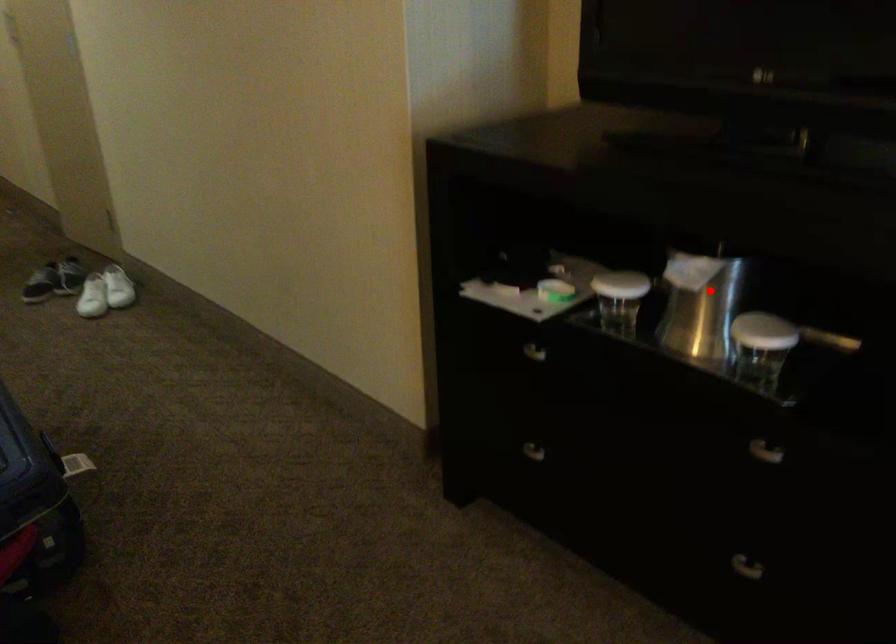
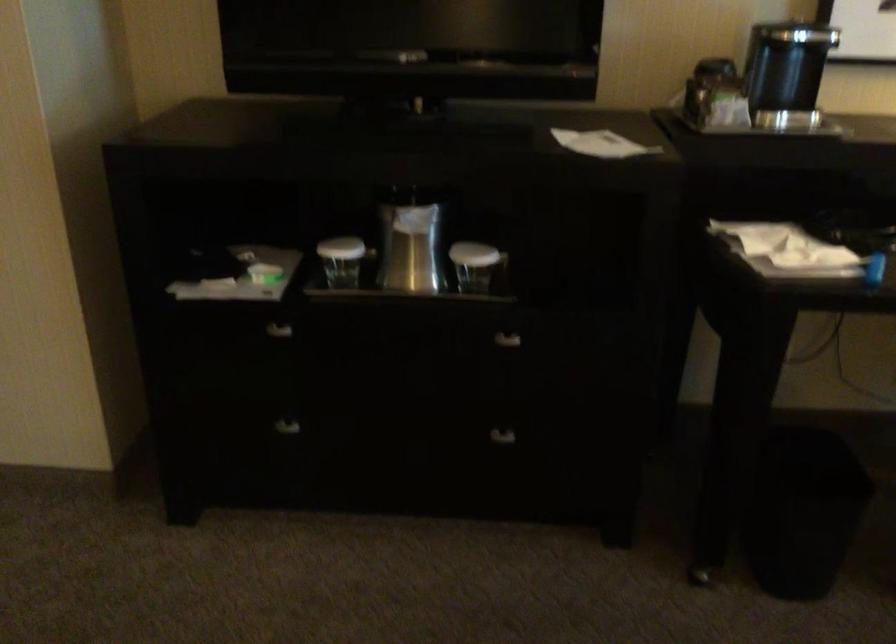
In the second image, find the point that corresponds to the highlighted location in the first image.

(410, 240)